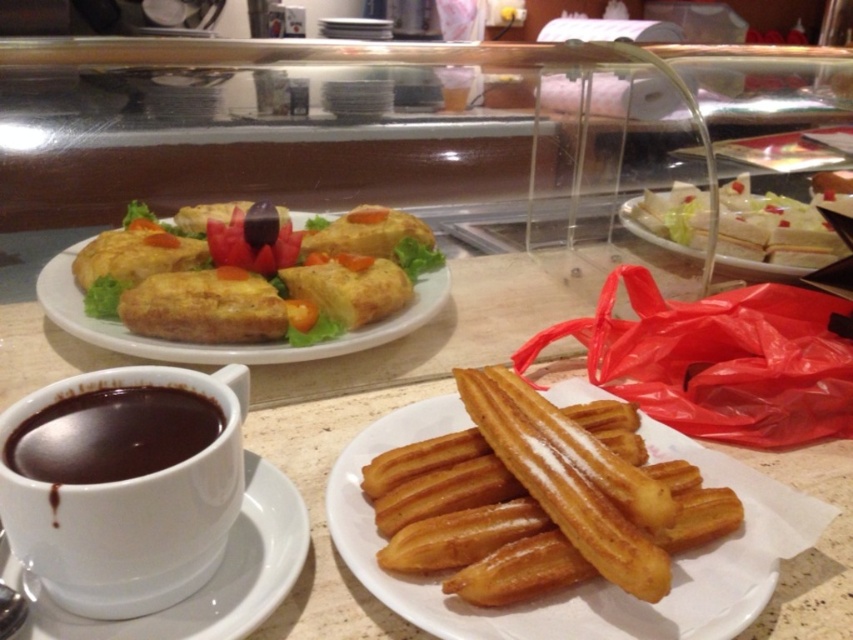
You are a barista placing a new order on the counter. The customer wants to place the white ceramic saucer at lower left next to the dark chocolate cup at lower left. Is there enough space between them to fit a 5 cm wide saucer?

The white ceramic saucer at lower left and dark chocolate cup at lower left are 7.68 centimeters apart from each other. Since the saucer is 5 cm wide, there is enough space between them to fit it.

You are a customer at a bakery and want to place your dessert on the table. You have a white ceramic saucer at lower left and a dark chocolate cup at lower left. Which item is positioned lower on the table?

The white ceramic saucer at lower left is below dark chocolate cup at lower left, so it is positioned lower on the table.